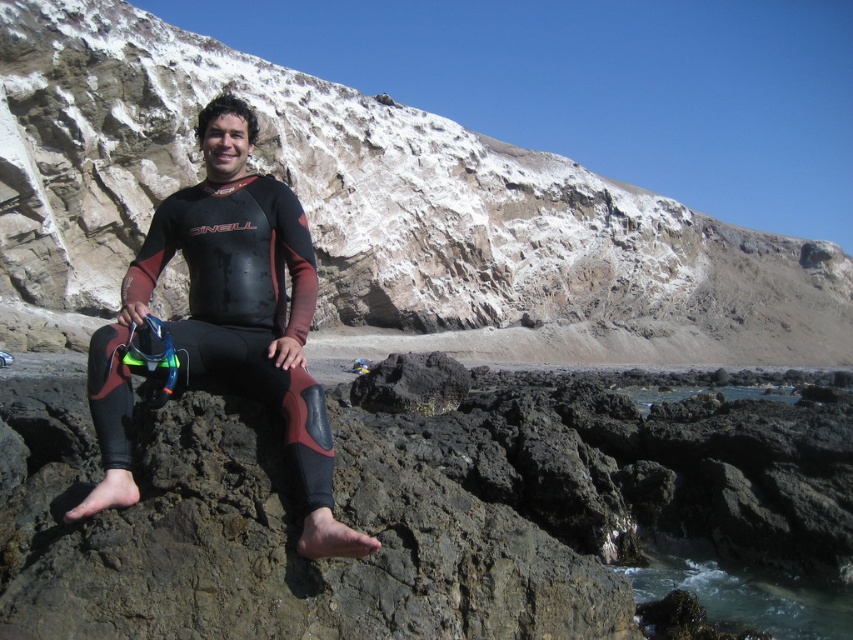
You are a safety officer assessing the distance between the black matte wetsuit at center and the clear water at lower right. Based on the scene, can you confirm if the distance is more than 20 meters?

The black matte wetsuit at center and clear water at lower right are 24.61 meters apart, so yes, the distance is more than 20 meters.

Looking at this image, based on the scene, which object occupies a larger area in the image? Please choose between the rugged stone cliff at center and the clear water at lower right.

The rugged stone cliff at center is bigger than the clear water at lower right, so the rugged stone cliff at center occupies a larger area in the image.